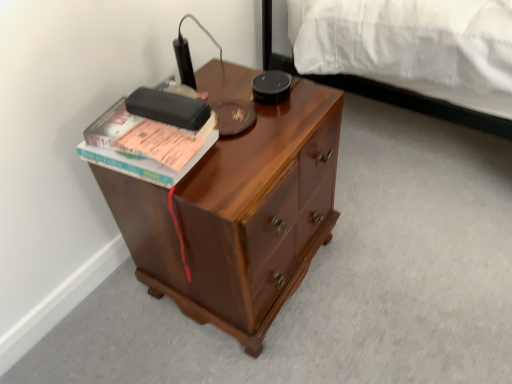
The height and width of the screenshot is (384, 512). Find the location of `vacant area located to the right-hand side of shiny brown wooden desk at center`. vacant area located to the right-hand side of shiny brown wooden desk at center is located at coordinates (387, 261).